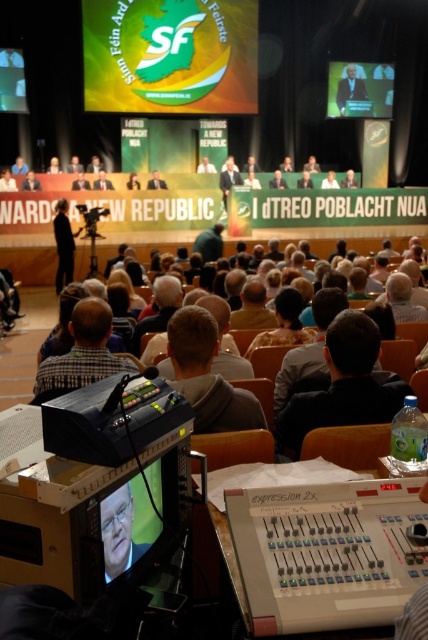
Does plaid fabric shirt at center have a smaller size compared to light brown suit at upper center?

Correct, plaid fabric shirt at center occupies less space than light brown suit at upper center.

Does point (92, 296) come farther from viewer compared to point (357, 83)?

No, (92, 296) is in front of (357, 83).

Where is `plaid fabric shirt at center`? plaid fabric shirt at center is located at coordinates (83, 352).

Does dark gray suit at center have a lesser width compared to blonde hair at center?

In fact, dark gray suit at center might be wider than blonde hair at center.

Is dark gray suit at center to the right of blonde hair at center from the viewer's perspective?

Correct, you'll find dark gray suit at center to the right of blonde hair at center.

You are a GUI agent. You are given a task and a screenshot of the screen. Output one action in this format:
    pyautogui.click(x=<x>, y=<y>)
    Task: Click on the dark gray suit at center
    Image resolution: width=428 pixels, height=640 pixels.
    Given the screenshot: What is the action you would take?
    pyautogui.click(x=341, y=385)

Where is `dark gray suit at center`? This screenshot has width=428, height=640. dark gray suit at center is located at coordinates (341, 385).

Between green matte logo at upper center and plaid fabric shirt at center, which one appears on the right side from the viewer's perspective?

plaid fabric shirt at center is more to the right.

Is green matte logo at upper center bigger than plaid fabric shirt at center?

Correct, green matte logo at upper center is larger in size than plaid fabric shirt at center.

Does point (189, 36) come in front of point (104, 337)?

No.

This screenshot has width=428, height=640. In order to click on green matte logo at upper center in this screenshot , I will do `click(169, 54)`.